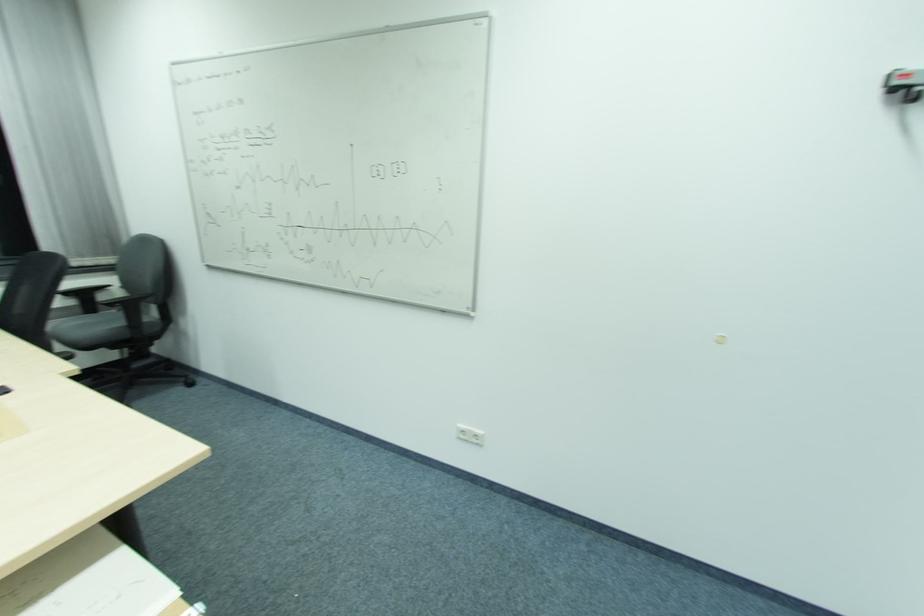
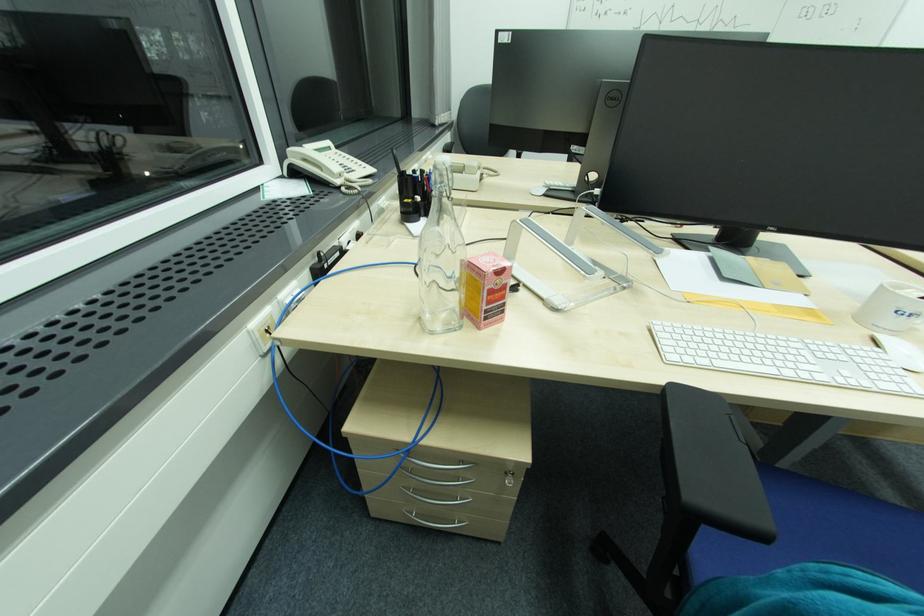
Question: In a continuous first-person perspective shot, in which direction is the camera moving?

Choices:
 (A) Left
 (B) Right
 (C) Forward
 (D) Backward

Answer: (A)